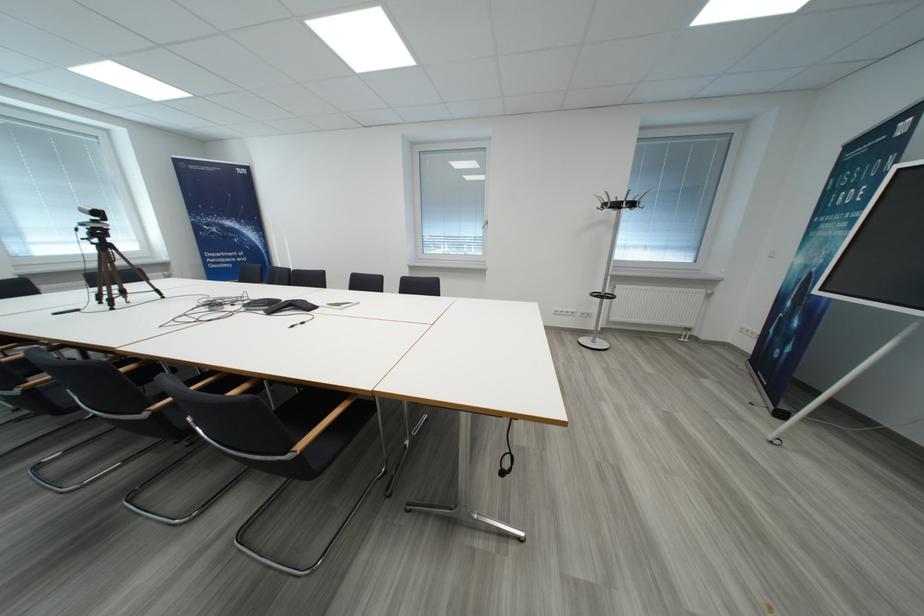
Find where to sit the black chair sitting surface. Please return your answer as a coordinate pair (x, y).

(311, 431)